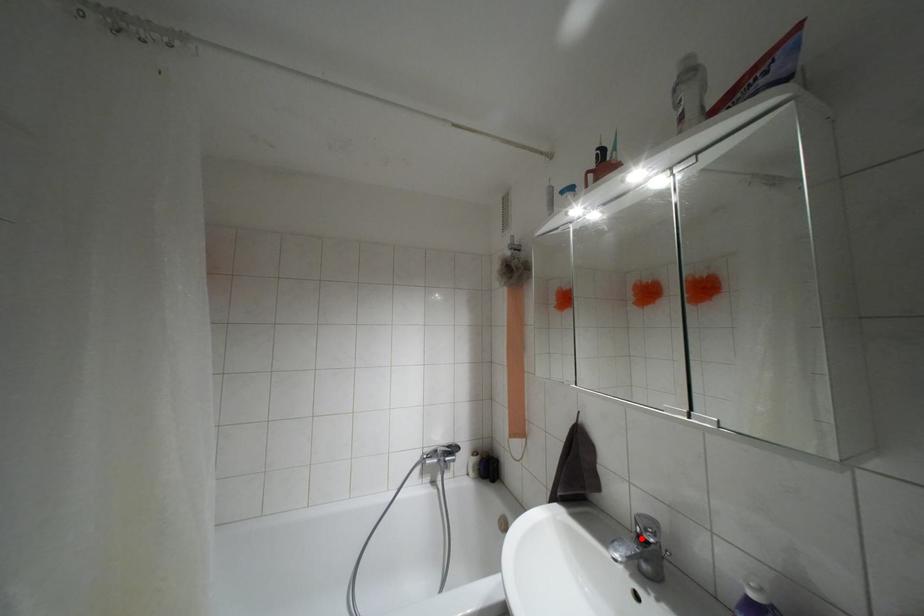
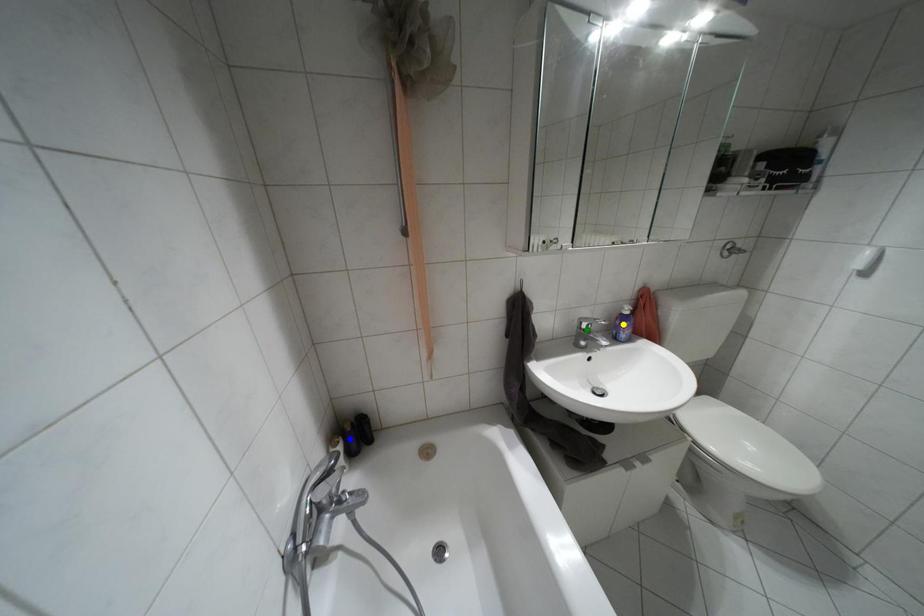
Question: I am providing you with two images of the same scene from different viewpoints. A red point is marked on the first image. You are given multiple points on the second image. Which mark in image 2 goes with the point in image 1?

Choices:
 (A) yellow point
 (B) green point
 (C) blue point

Answer: (B)